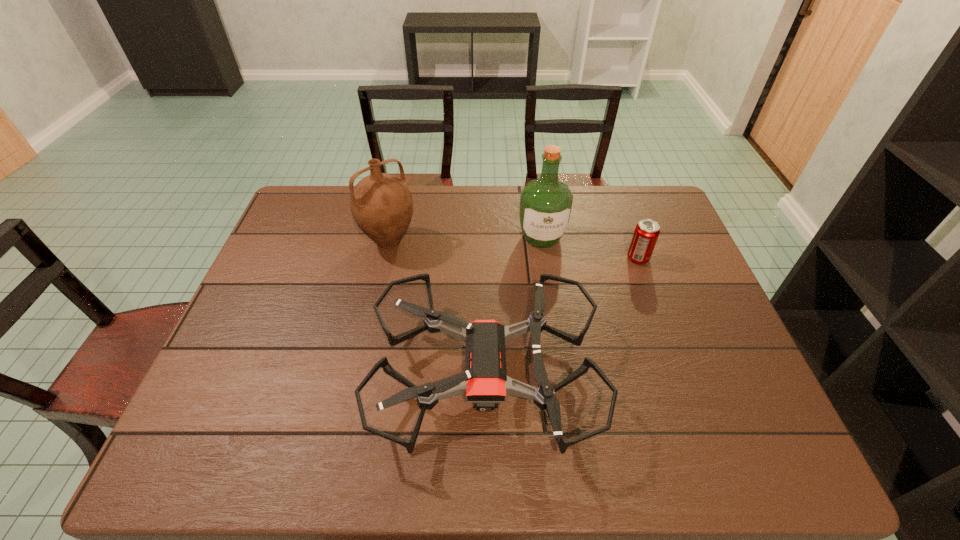
Identify which object is the third nearest to the liquor. Please provide its 2D coordinates. Your answer should be formatted as a tuple, i.e. [(x, y)], where the tuple contains the x and y coordinates of a point satisfying the conditions above.

[(381, 204)]

The width and height of the screenshot is (960, 540). In order to click on free region that satisfies the following two spatial constraints: 1. on the front-facing side of the rightmost object; 2. on the right side of the liquor in this screenshot , I will do (544, 258).

At what (x,y) coordinates should I click in order to perform the action: click on vacant area that satisfies the following two spatial constraints: 1. on the front-facing side of the soda can; 2. on the left side of the liquor. Please return your answer as a coordinate pair (x, y). This screenshot has height=540, width=960. Looking at the image, I should click on (544, 258).

Identify the location of vacant region that satisfies the following two spatial constraints: 1. on the front-facing side of the liquor; 2. on the right side of the rightmost object. (544, 258).